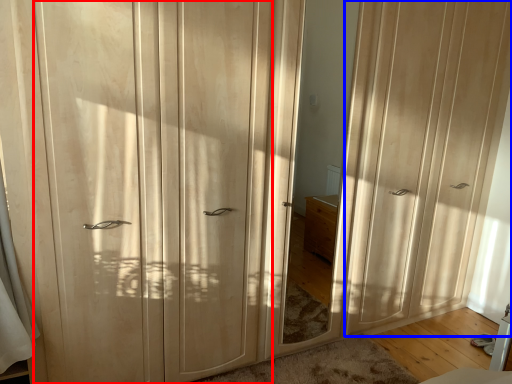
Question: Which object is closer to the camera taking this photo, screen door (highlighted by a red box) or screen door (highlighted by a blue box)?

Choices:
 (A) screen door
 (B) screen door

Answer: (A)